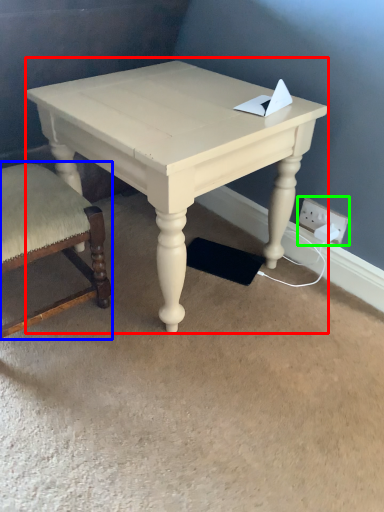
Question: Estimate the real-world distances between objects in this image. Which object is farther from table (highlighted by a red box), chair (highlighted by a blue box) or electric outlet (highlighted by a green box)?

Choices:
 (A) chair
 (B) electric outlet

Answer: (B)